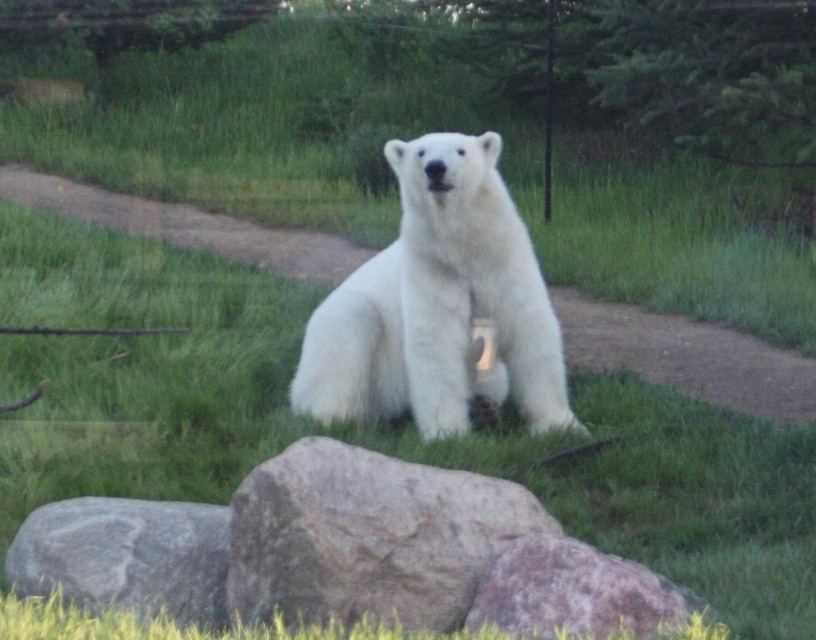
Is white fluffy bear at center to the left of gray rough rock at center from the viewer's perspective?

Incorrect, white fluffy bear at center is not on the left side of gray rough rock at center.

Can you confirm if white fluffy bear at center is bigger than gray rough rock at center?

Correct, white fluffy bear at center is larger in size than gray rough rock at center.

Does point (495, 157) come behind point (432, 493)?

Yes, it is.

Where is `white fluffy bear at center`? The width and height of the screenshot is (816, 640). white fluffy bear at center is located at coordinates (438, 305).

Does white fluffy bear at center have a larger size compared to gray rock at lower left?

Indeed, white fluffy bear at center has a larger size compared to gray rock at lower left.

Is point (420, 401) positioned in front of point (220, 612)?

No, (420, 401) is further to viewer.

From the picture: Measure the distance between point (415, 353) and camera.

Point (415, 353) and camera are 7.36 meters apart from each other.

The width and height of the screenshot is (816, 640). I want to click on white fluffy bear at center, so click(x=438, y=305).

The height and width of the screenshot is (640, 816). Find the location of `white fluffy bear at center`. white fluffy bear at center is located at coordinates (438, 305).